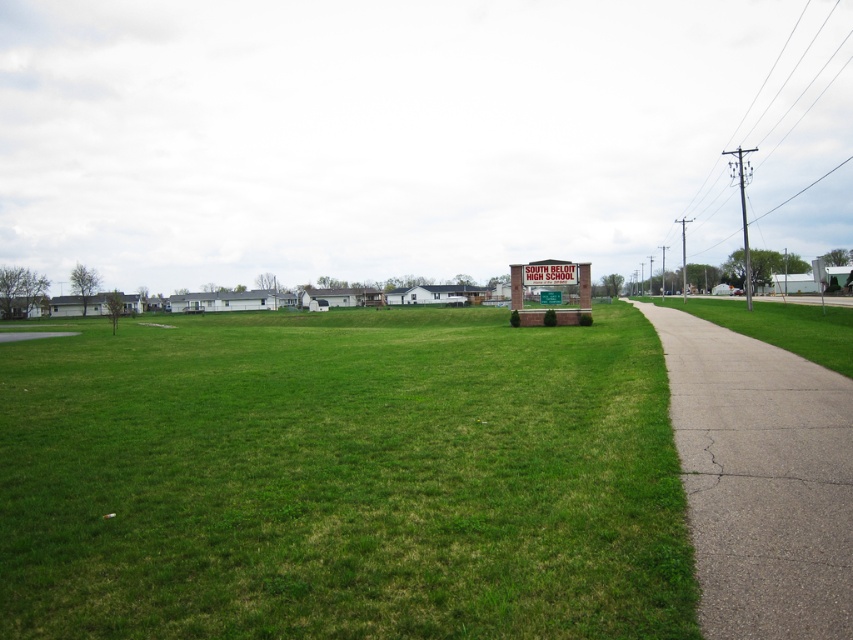
Question: Is green grassy field at center further to camera compared to green grass at lower right?

Choices:
 (A) no
 (B) yes

Answer: (A)

Question: Considering the real-world distances, which object is farthest from the gray asphalt sidewalk at right?

Choices:
 (A) green grass at lower right
 (B) green grassy field at center
 (C) green painted metal sign at center

Answer: (C)

Question: Among these points, which one is nearest to the camera?

Choices:
 (A) (564, 266)
 (B) (811, 305)

Answer: (A)

Question: Does green grass at lower right appear over green painted metal sign at center?

Choices:
 (A) no
 (B) yes

Answer: (A)

Question: Can you confirm if green grassy field at center is positioned below green painted metal sign at center?

Choices:
 (A) yes
 (B) no

Answer: (A)

Question: Which object is closer to the camera taking this photo?

Choices:
 (A) green painted metal sign at center
 (B) green grass at lower right
 (C) gray asphalt sidewalk at right
 (D) green grassy field at center

Answer: (C)